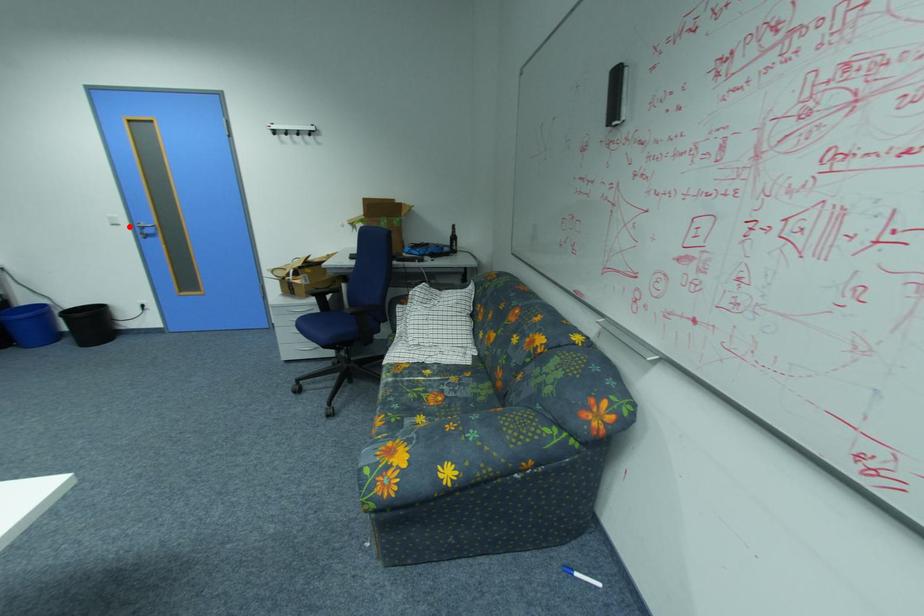
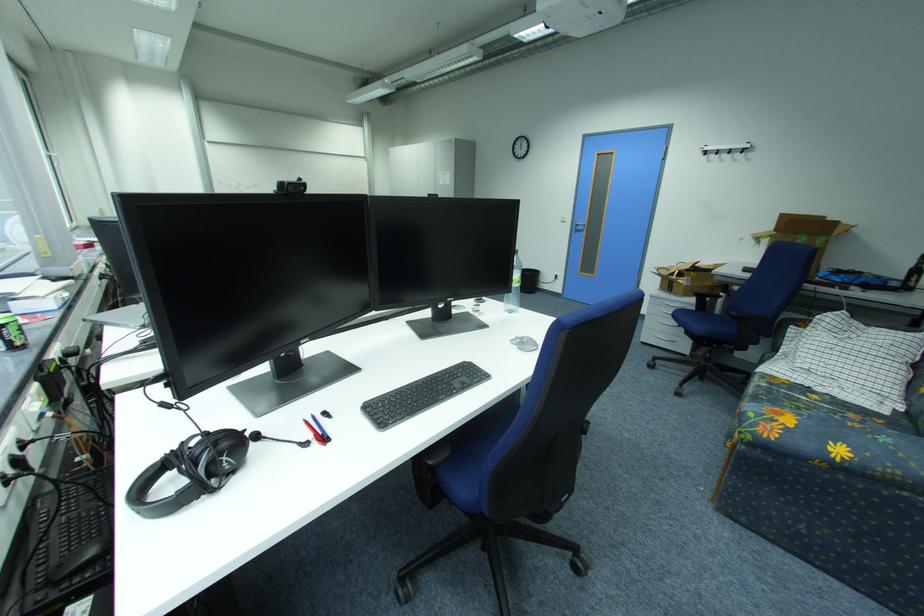
Question: I am providing you with two images of the same scene from different viewpoints. In image1, a red point is highlighted. Considering the same 3D point in image2, which of the following is correct?

Choices:
 (A) It is closer
 (B) It is farther

Answer: (A)